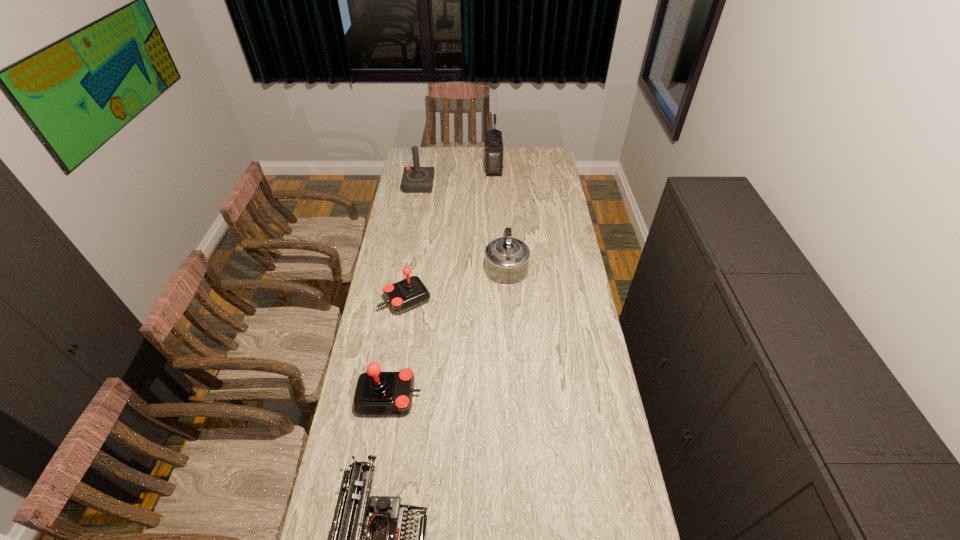
Locate an element on the screen. The height and width of the screenshot is (540, 960). vacant space situated with the spout at the front of the kettle is located at coordinates (504, 227).

At what (x,y) coordinates should I click in order to perform the action: click on vacant space located 0.090m with the spout at the front of the kettle. Please return your answer as a coordinate pair (x, y). The width and height of the screenshot is (960, 540). Looking at the image, I should click on (504, 233).

Locate an element on the screen. The image size is (960, 540). free space located on the base of the nearest joystick is located at coordinates (444, 396).

Identify the location of vacant space located on the back of the second farthest joystick. This screenshot has width=960, height=540. (417, 232).

Locate an element on the screen. The width and height of the screenshot is (960, 540). object that is at the far edge is located at coordinates (494, 148).

In the image, there is a desktop. Where is `vacant area at the far edge`? This screenshot has width=960, height=540. vacant area at the far edge is located at coordinates (442, 157).

The height and width of the screenshot is (540, 960). I want to click on vacant space at the left edge of the desktop, so click(x=350, y=422).

Locate an element on the screen. This screenshot has height=540, width=960. free space at the right edge is located at coordinates (586, 384).

Identify the location of free spot at the far right corner of the desktop. The height and width of the screenshot is (540, 960). (535, 165).

At what (x,y) coordinates should I click in order to perform the action: click on empty space between the kettle and the nearest joystick. Please return your answer as a coordinate pair (x, y). The height and width of the screenshot is (540, 960). Looking at the image, I should click on click(447, 330).